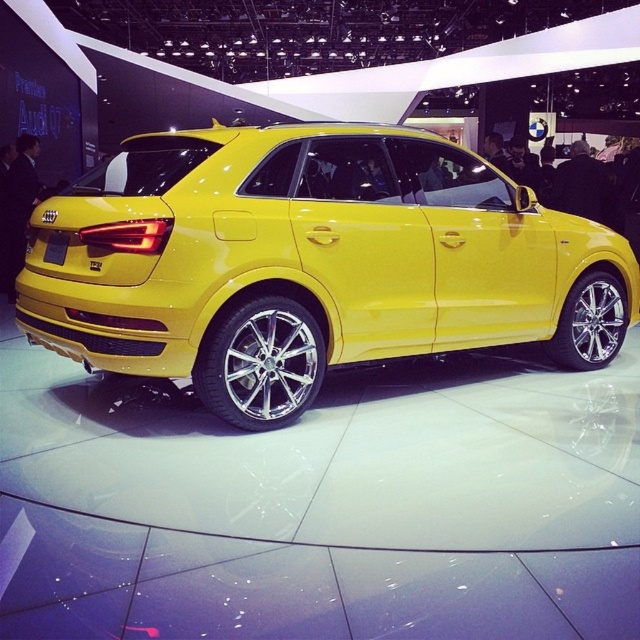
Question: Among these objects, which one is farthest from the camera?

Choices:
 (A) yellow metallic car at center
 (B) yellow matte license plate at rear

Answer: (B)

Question: Which of the following is the closest to the observer?

Choices:
 (A) yellow metallic car at center
 (B) yellow matte license plate at rear

Answer: (A)

Question: Does yellow metallic car at center lie in front of yellow matte license plate at rear?

Choices:
 (A) no
 (B) yes

Answer: (B)

Question: Is yellow metallic car at center smaller than yellow matte license plate at rear?

Choices:
 (A) yes
 (B) no

Answer: (B)

Question: Is yellow metallic car at center in front of yellow matte license plate at rear?

Choices:
 (A) yes
 (B) no

Answer: (A)

Question: Which point appears farthest from the camera in this image?

Choices:
 (A) (56, 252)
 (B) (419, 184)

Answer: (B)